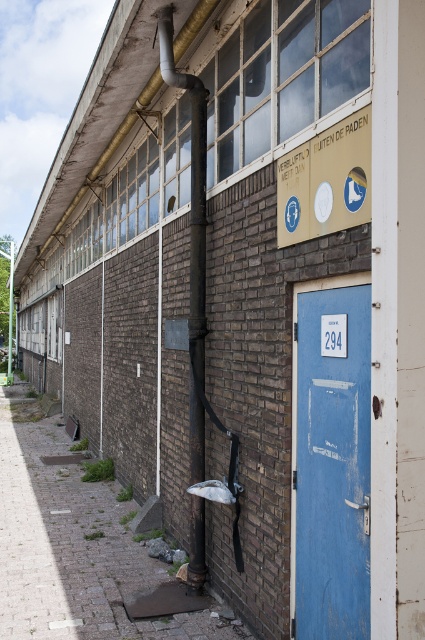
Question: Which point is farther to the camera?

Choices:
 (A) (x=351, y=609)
 (B) (x=44, y=451)
 (C) (x=283, y=170)

Answer: (B)

Question: Is brick wall at center positioned before blue matte door at center?

Choices:
 (A) yes
 (B) no

Answer: (B)

Question: Is brick wall at center to the right of yellow matte sign at upper center from the viewer's perspective?

Choices:
 (A) yes
 (B) no

Answer: (B)

Question: Does blue matte door at center appear over yellow matte sign at upper center?

Choices:
 (A) yes
 (B) no

Answer: (B)

Question: Considering the real-world distances, which object is farthest from the blue matte door at center?

Choices:
 (A) yellow matte sign at upper center
 (B) brick wall at center

Answer: (B)

Question: Based on their relative distances, which object is nearer to the blue matte door at center?

Choices:
 (A) brick wall at center
 (B) yellow matte sign at upper center

Answer: (B)